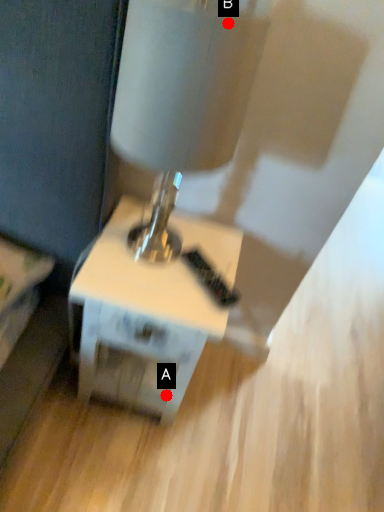
Question: Two points are circled on the image, labeled by A and B beside each circle. Which point is farther from the camera taking this photo?

Choices:
 (A) A is further
 (B) B is further

Answer: (A)